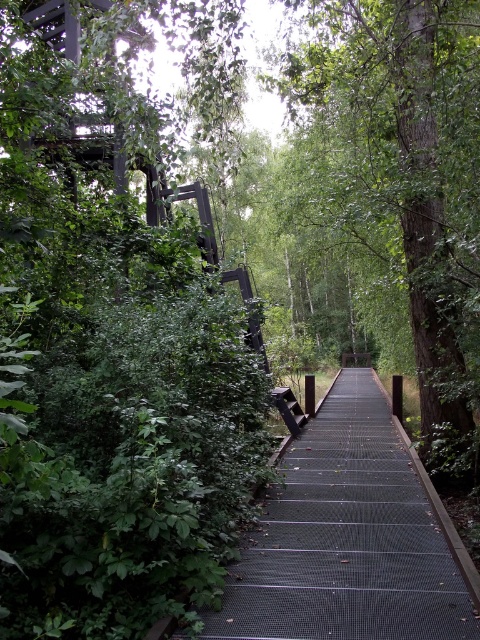
You are standing on the walkway and want to take a photo of the green leafy tree at center. Where should you position yourself to capture it in the frame?

To capture the green leafy tree at center in your photo, position yourself at point 0.283 along the horizontal axis and 0.846 along the vertical axis.

From the picture: You are a hiker who wants to take a photo of the black mesh staircase at center without any obstructions. Based on the scene, is the green leafy tree at center blocking your view of the staircase? Please explain.

The black mesh staircase at center is behind green leafy tree at center, so the tree is blocking the view of the staircase. To take a photo without obstruction, you would need to move to a position where the tree is not in front of the staircase.